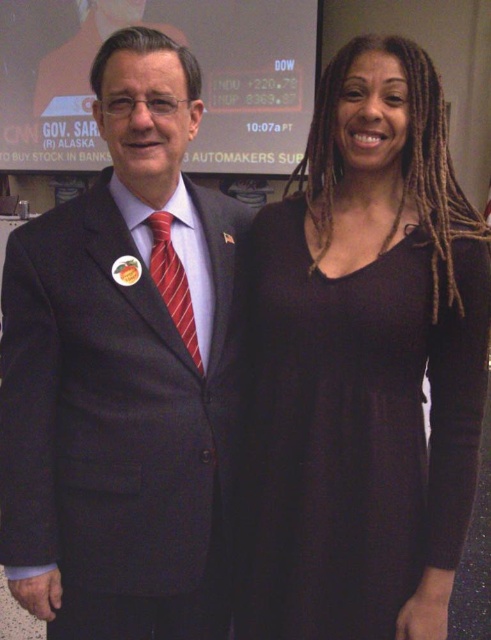
Question: Which point is closer to the camera taking this photo?

Choices:
 (A) (434, 77)
 (B) (136, 397)
 (C) (81, 13)
 (D) (183, 307)

Answer: (B)

Question: Can you confirm if dark matte dress at right is smaller than matte black screen at upper center?

Choices:
 (A) yes
 (B) no

Answer: (A)

Question: Does matte black suit at center have a larger size compared to red striped tie at center?

Choices:
 (A) yes
 (B) no

Answer: (A)

Question: Which point appears farthest from the camera in this image?

Choices:
 (A) (178, 312)
 (B) (82, 52)

Answer: (B)

Question: Which point is closer to the camera taking this photo?

Choices:
 (A) (386, 406)
 (B) (39, 76)
 (C) (136, 230)

Answer: (A)

Question: Is matte black suit at center to the right of red striped tie at center from the viewer's perspective?

Choices:
 (A) yes
 (B) no

Answer: (B)